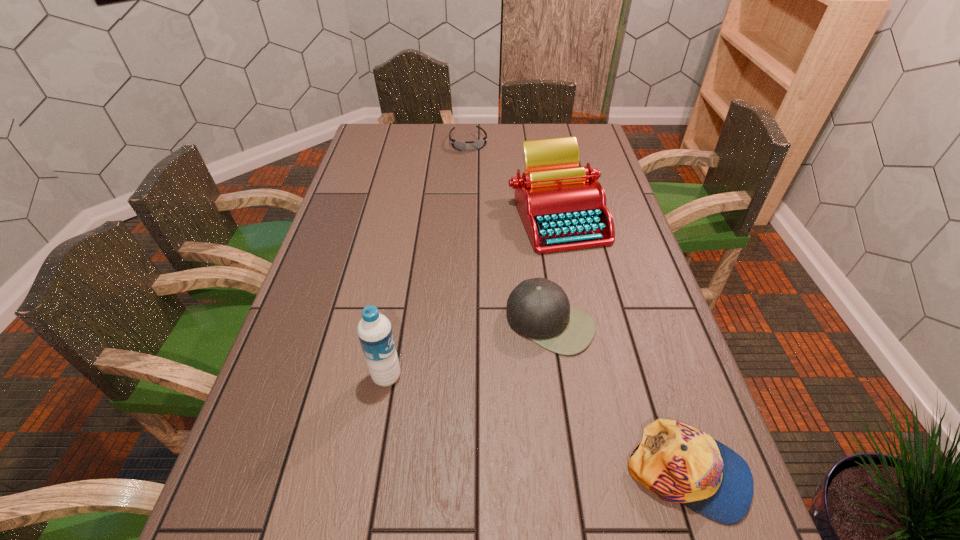
Identify the location of free space on the desktop that is between the water bottle and the nearer cap and is positioned on the typing side of the typewriter. (490, 410).

The width and height of the screenshot is (960, 540). What are the coordinates of `vacant spot on the desktop that is between the leftmost object and the nearer cap and is positioned on the brim of the farther cap` in the screenshot? It's located at (493, 411).

Locate an element on the screen. The width and height of the screenshot is (960, 540). free space on the desktop that is between the leftmost object and the nearest object and is positioned on the lenses of the sunglasses is located at coordinates (550, 430).